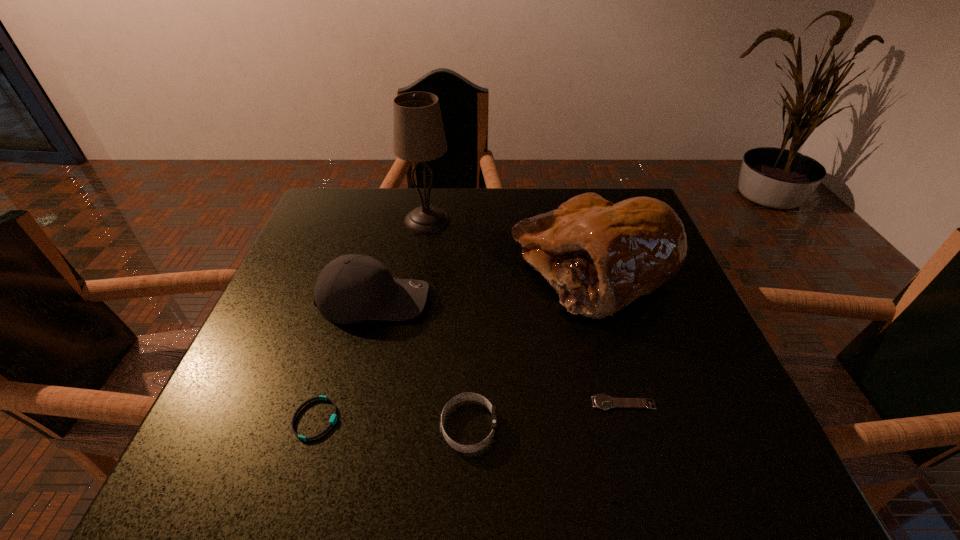
Where is `vacant space that satisfies the following two spatial constraints: 1. on the front-facing side of the shortest object; 2. on the right side of the lampshade`? The height and width of the screenshot is (540, 960). vacant space that satisfies the following two spatial constraints: 1. on the front-facing side of the shortest object; 2. on the right side of the lampshade is located at coordinates (398, 403).